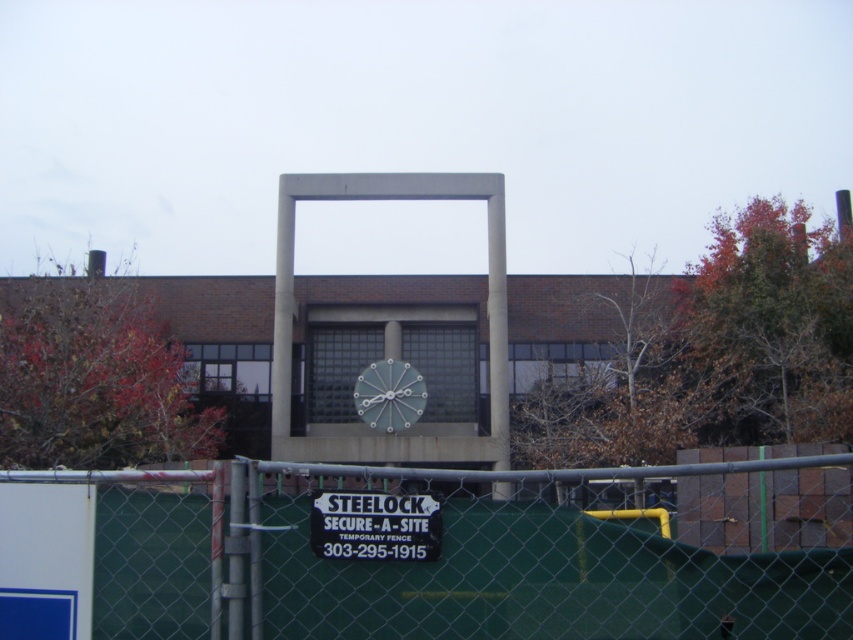
Does green chain-link fence at center appear over black plastic sign at center?

No, green chain-link fence at center is not above black plastic sign at center.

Is point (149, 502) positioned after point (328, 508)?

That is True.

The height and width of the screenshot is (640, 853). Find the location of `green chain-link fence at center`. green chain-link fence at center is located at coordinates (396, 556).